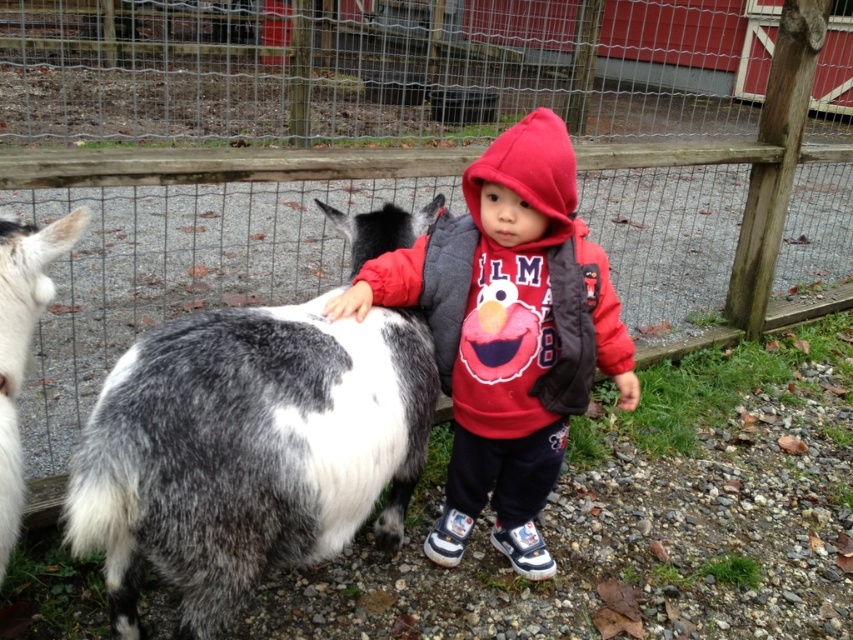
Is spotted fur goat at center thinner than white and gray fur goat at left?

Incorrect, spotted fur goat at center's width is not less than white and gray fur goat at left's.

Is point (260, 307) positioned behind point (36, 268)?

Yes, point (260, 307) is behind point (36, 268).

Describe the element at coordinates (247, 451) in the screenshot. I see `spotted fur goat at center` at that location.

Where is `spotted fur goat at center`? The width and height of the screenshot is (853, 640). spotted fur goat at center is located at coordinates (247, 451).

Between spotted fur goat at center and matte red hoodie at center, which one appears on the left side from the viewer's perspective?

From the viewer's perspective, spotted fur goat at center appears more on the left side.

What are the coordinates of `spotted fur goat at center` in the screenshot? It's located at (247, 451).

Where is `spotted fur goat at center`? spotted fur goat at center is located at coordinates (247, 451).

Which is below, matte red hoodie at center or white and gray fur goat at left?

white and gray fur goat at left is below.

Who is more forward, (544, 314) or (10, 262)?

Point (10, 262) is in front.

Who is more distant from viewer, (552, 170) or (12, 474)?

Positioned behind is point (552, 170).

This screenshot has width=853, height=640. I want to click on matte red hoodie at center, so click(508, 332).